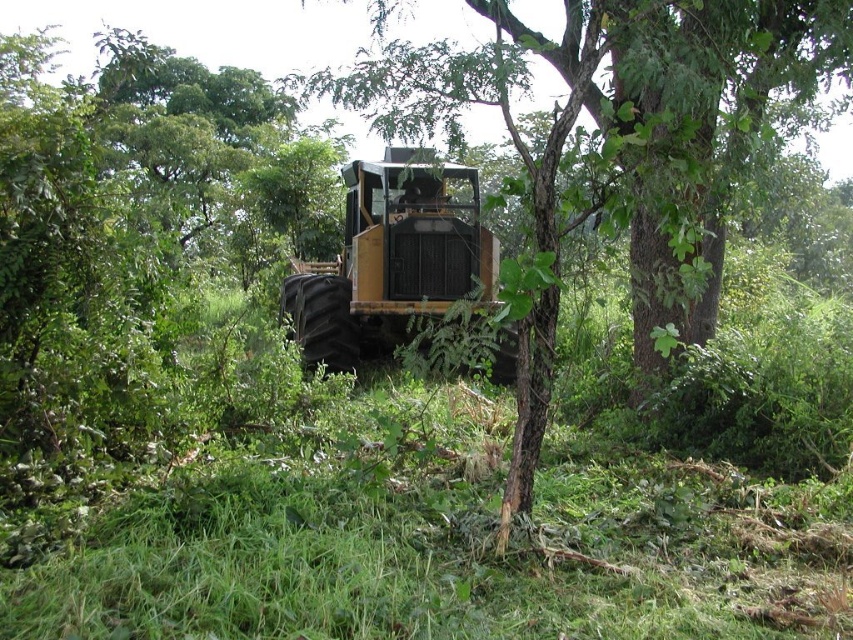
You are a forest worker needing to transport a heavy log using the yellow metallic tractor at center. The tractor has a maximum load width of 2 meters. Can the tractor safely carry the log if the log is as wide as the green leafy tree at center?

The green leafy tree at center is wider than the yellow metallic tractor at center. Since the tractor can only carry logs up to 2 meters wide, and the tree is wider than the tractor itself, the log would exceed the tractor s maximum load width. Therefore, the tractor cannot safely carry such a wide log.

You are a forester planning to move the yellow metallic tractor at center to a different location. Considering the size of the green leafy tree at center, can you estimate if the tractor will fit through a narrow path that is just wide enough for the tree?

The green leafy tree at center is larger than the yellow metallic tractor at center. Since the path is wide enough for the tree, the tractor will fit through the path as it is smaller in size.